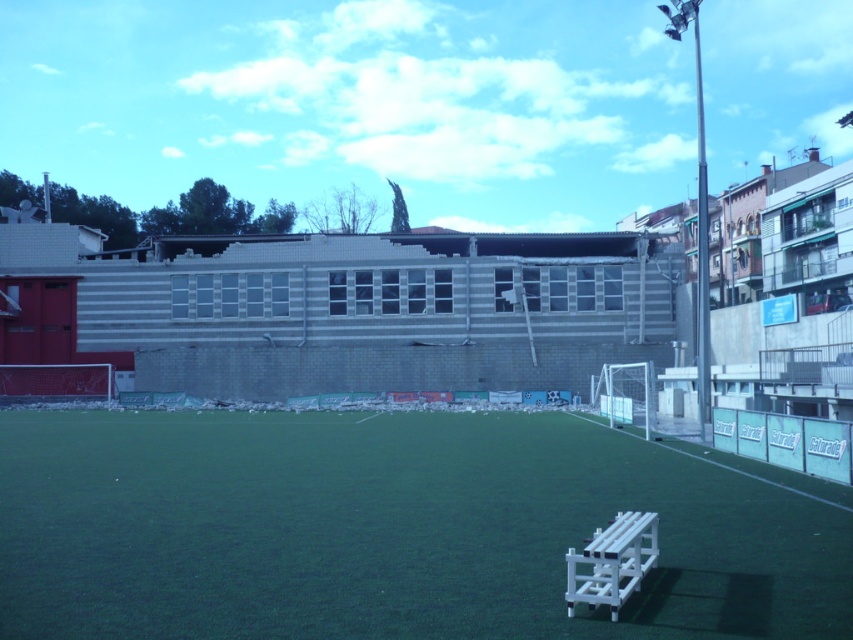
Question: Which point is farther to the camera?

Choices:
 (A) (637, 566)
 (B) (73, 596)

Answer: (A)

Question: Does green artificial turf at center lie in front of white plastic bench at lower right?

Choices:
 (A) yes
 (B) no

Answer: (A)

Question: Which point is farther to the camera?

Choices:
 (A) (392, 428)
 (B) (633, 576)

Answer: (A)

Question: Among these objects, which one is nearest to the camera?

Choices:
 (A) green artificial turf at center
 (B) white plastic bench at lower right

Answer: (A)

Question: Does green artificial turf at center have a greater width compared to white plastic bench at lower right?

Choices:
 (A) no
 (B) yes

Answer: (B)

Question: Can you confirm if green artificial turf at center is positioned above white plastic bench at lower right?

Choices:
 (A) yes
 (B) no

Answer: (B)